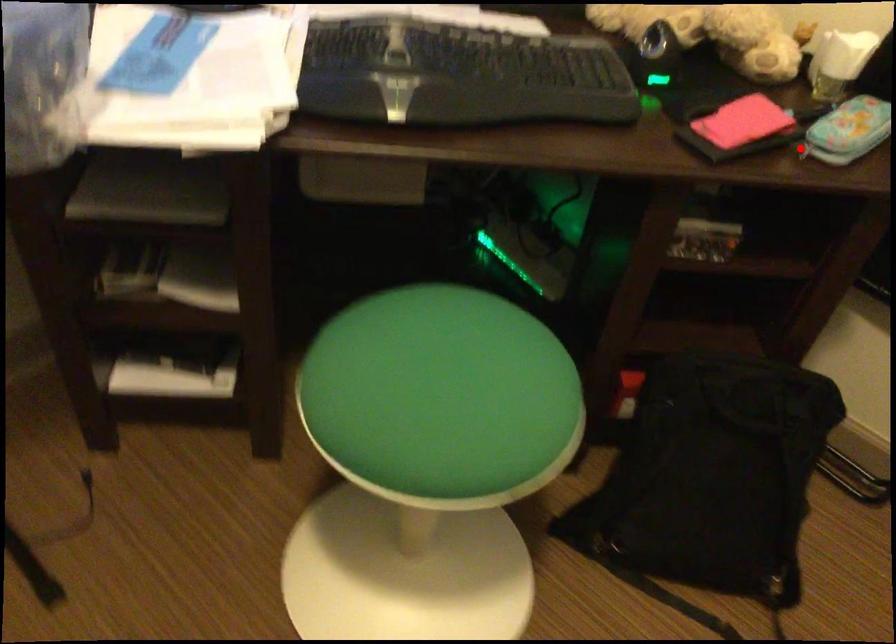
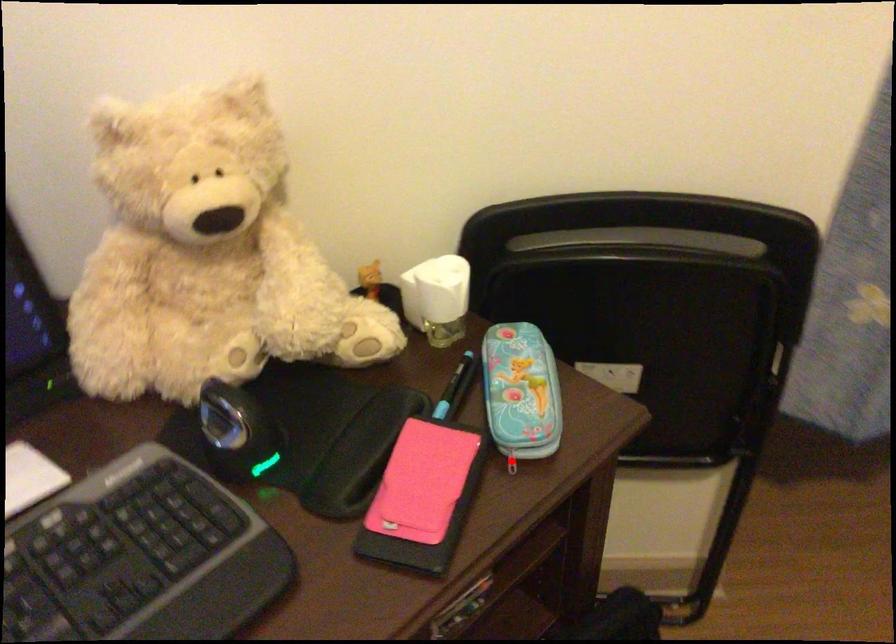
I am providing you with two images of the same scene from different viewpoints. A red point is marked on the first image and another point is marked on the second image. Is the red point in image1 aligned with the point shown in image2?

Yes